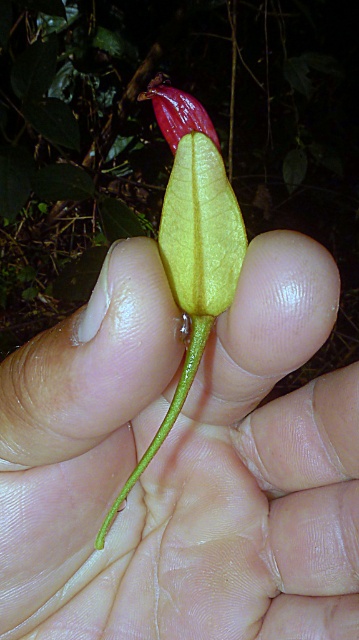
Question: Which of the following is the farthest from the observer?

Choices:
 (A) yellow matte leaf at center
 (B) glossy red flower at upper center
 (C) yellow matte flower at center
 (D) green glossy stem at center

Answer: (A)

Question: Where is green glossy stem at center located in relation to glossy red flower at upper center in the image?

Choices:
 (A) below
 (B) above

Answer: (A)

Question: Can you confirm if yellow matte flower at center is positioned to the left of green glossy stem at center?

Choices:
 (A) yes
 (B) no

Answer: (B)

Question: Does yellow matte flower at center have a larger size compared to green glossy stem at center?

Choices:
 (A) no
 (B) yes

Answer: (B)

Question: Which point is farther from the camera taking this photo?

Choices:
 (A) (201, 104)
 (B) (62, 172)
 (C) (170, 417)
 (D) (291, 516)

Answer: (B)

Question: Which object is farther from the camera taking this photo?

Choices:
 (A) green glossy stem at center
 (B) yellow matte flower at center
 (C) yellow matte leaf at center
 (D) glossy red flower at upper center

Answer: (C)